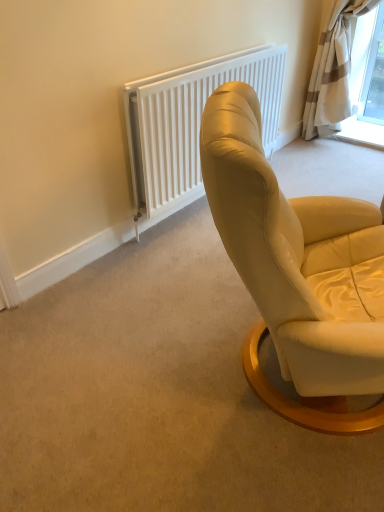
Question: Is white textured radiator at upper center not near beige striped fabric curtain at upper right?

Choices:
 (A) yes
 (B) no

Answer: (A)

Question: From a real-world perspective, is white textured radiator at upper center located beneath beige striped fabric curtain at upper right?

Choices:
 (A) yes
 (B) no

Answer: (A)

Question: Is beige striped fabric curtain at upper right at the back of white textured radiator at upper center?

Choices:
 (A) no
 (B) yes

Answer: (A)

Question: Can you confirm if white textured radiator at upper center is wider than beige striped fabric curtain at upper right?

Choices:
 (A) yes
 (B) no

Answer: (B)

Question: Is white textured radiator at upper center closer to the viewer compared to beige striped fabric curtain at upper right?

Choices:
 (A) yes
 (B) no

Answer: (A)

Question: Does white textured radiator at upper center have a lesser height compared to beige striped fabric curtain at upper right?

Choices:
 (A) no
 (B) yes

Answer: (B)

Question: From a real-world perspective, is beige striped fabric curtain at upper right over white textured radiator at upper center?

Choices:
 (A) no
 (B) yes

Answer: (B)

Question: Is beige striped fabric curtain at upper right behind white textured radiator at upper center?

Choices:
 (A) yes
 (B) no

Answer: (A)

Question: Could you tell me if beige striped fabric curtain at upper right is turned towards white textured radiator at upper center?

Choices:
 (A) yes
 (B) no

Answer: (A)

Question: Is white textured radiator at upper center at the back of beige striped fabric curtain at upper right?

Choices:
 (A) yes
 (B) no

Answer: (B)

Question: Does beige striped fabric curtain at upper right contain white textured radiator at upper center?

Choices:
 (A) no
 (B) yes

Answer: (A)

Question: Is beige striped fabric curtain at upper right not close to white textured radiator at upper center?

Choices:
 (A) no
 (B) yes

Answer: (B)

Question: Is white textured radiator at upper center inside or outside of beige striped fabric curtain at upper right?

Choices:
 (A) outside
 (B) inside

Answer: (A)